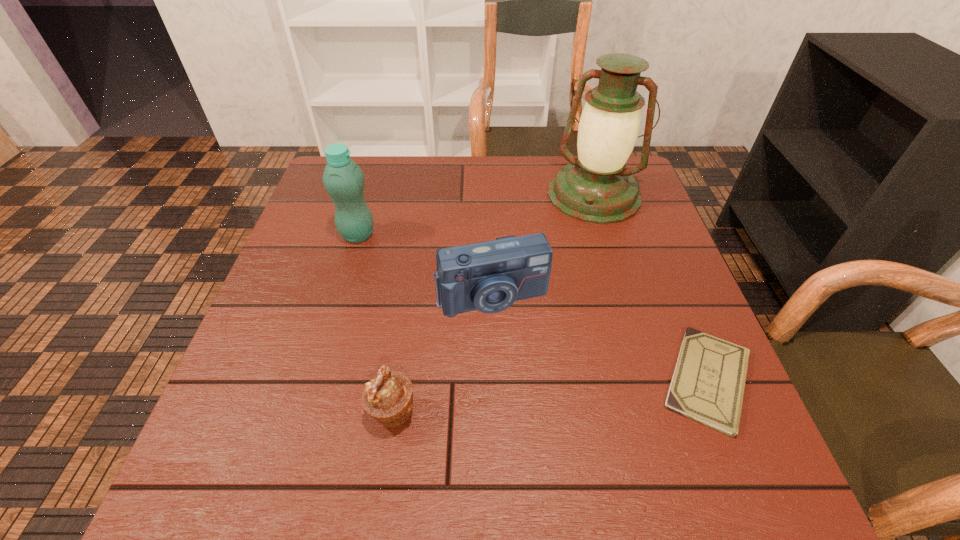
Identify the location of muffin. (388, 397).

Identify the location of the fourth tallest object. (388, 397).

Locate an element on the screen. This screenshot has width=960, height=540. checkbook is located at coordinates (708, 383).

Where is `the third farthest object`? The image size is (960, 540). the third farthest object is located at coordinates (490, 276).

At what (x,y) coordinates should I click in order to perform the action: click on camera. Please return your answer as a coordinate pair (x, y). Looking at the image, I should click on (490, 276).

At what (x,y) coordinates should I click in order to perform the action: click on the leftmost object. Please return your answer as a coordinate pair (x, y). The image size is (960, 540). Looking at the image, I should click on (343, 179).

Image resolution: width=960 pixels, height=540 pixels. Find the location of `the fourth shortest object`. the fourth shortest object is located at coordinates (343, 179).

Locate an element on the screen. The image size is (960, 540). the tallest object is located at coordinates (595, 187).

Where is `free space located on the back of the second shortest object`? free space located on the back of the second shortest object is located at coordinates (413, 277).

Identify the location of free space located 0.240m on the left of the checkbook. This screenshot has width=960, height=540. (527, 380).